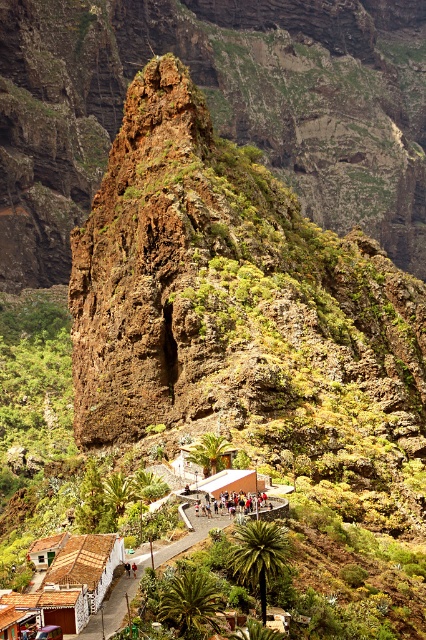
Question: Which is nearer to the wooden hut at center?

Choices:
 (A) brown thatched roof hut at lower left
 (B) multicolored clothing at center

Answer: (B)

Question: Can you confirm if brown tiled roofs at lower center is thinner than brown wooden hut at lower left?

Choices:
 (A) yes
 (B) no

Answer: (B)

Question: Can you confirm if brown wooden hut at lower left is positioned below wooden hut at center?

Choices:
 (A) yes
 (B) no

Answer: (A)

Question: Which point is closer to the camera?

Choices:
 (A) (259, 483)
 (B) (71, 561)
 (C) (233, 502)

Answer: (B)

Question: Which of the following is the closest to the observer?

Choices:
 (A) (219, 486)
 (B) (230, 506)

Answer: (B)

Question: In this image, where is brown thatched roof hut at lower left located relative to multicolored clothing at center?

Choices:
 (A) above
 (B) below

Answer: (B)